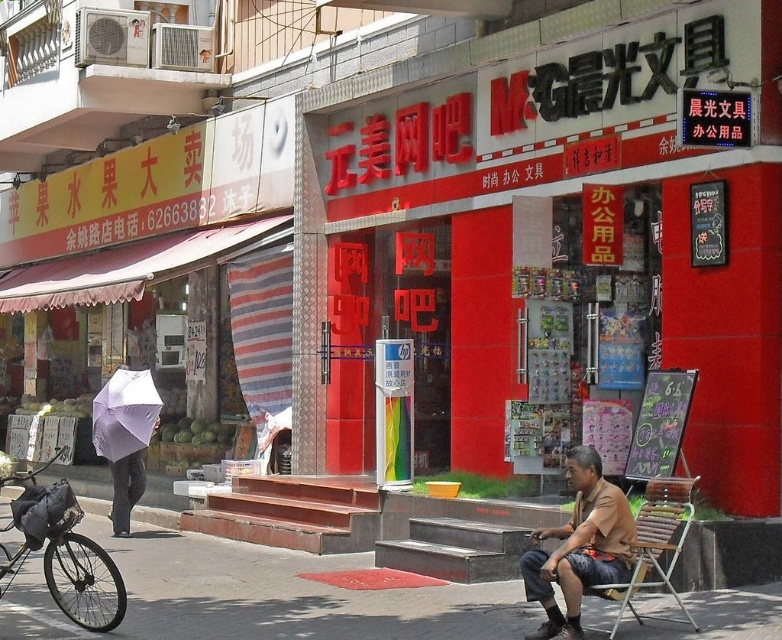
Who is more forward, (x=585, y=461) or (x=691, y=500)?

Point (x=585, y=461)

Who is more distant from viewer, [558,556] or [647,516]?

The point [647,516] is behind.

I want to click on brown cotton shirt at lower right, so click(x=580, y=547).

Does brown cotton shirt at lower right appear on the left side of white matte umbrella at left?

In fact, brown cotton shirt at lower right is to the right of white matte umbrella at left.

Which is more to the left, brown cotton shirt at lower right or white matte umbrella at left?

white matte umbrella at left

Which is behind, point (585, 557) or point (149, 388)?

The point (149, 388) is behind.

This screenshot has width=782, height=640. Identify the location of brown cotton shirt at lower right. (580, 547).

Is gray concrete pavement at lower center bigger than wooden folding chair at lower right?

Incorrect, gray concrete pavement at lower center is not larger than wooden folding chair at lower right.

Is point (192, 637) more distant than point (678, 500)?

No, it is not.

Is point (140, 563) positioned before point (635, 520)?

No, it is not.

The image size is (782, 640). What are the coordinates of `gray concrete pavement at lower center` in the screenshot? It's located at pos(289,595).